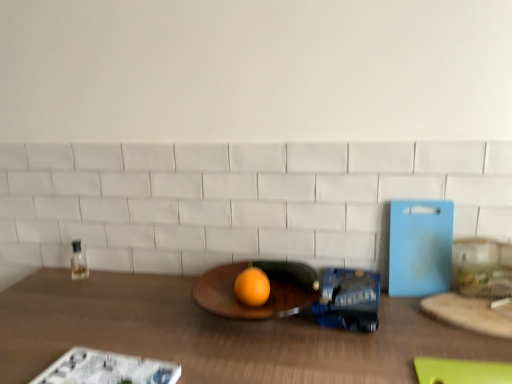
Question: Considering the relative sizes of orange matte grapefruit at center and wooden table at center in the image provided, is orange matte grapefruit at center shorter than wooden table at center?

Choices:
 (A) no
 (B) yes

Answer: (B)

Question: Is orange matte grapefruit at center facing away from wooden table at center?

Choices:
 (A) yes
 (B) no

Answer: (B)

Question: Is wooden table at center located within orange matte grapefruit at center?

Choices:
 (A) yes
 (B) no

Answer: (B)

Question: Considering the relative positions of orange matte grapefruit at center and wooden table at center in the image provided, is orange matte grapefruit at center behind wooden table at center?

Choices:
 (A) no
 (B) yes

Answer: (B)

Question: Is orange matte grapefruit at center far from wooden table at center?

Choices:
 (A) no
 (B) yes

Answer: (A)

Question: Is the depth of orange matte grapefruit at center less than that of wooden table at center?

Choices:
 (A) yes
 (B) no

Answer: (B)

Question: From the image's perspective, is clear glass bottle at left located beneath wooden cutting board at right?

Choices:
 (A) no
 (B) yes

Answer: (A)

Question: Does clear glass bottle at left lie in front of wooden cutting board at right?

Choices:
 (A) yes
 (B) no

Answer: (B)

Question: Is clear glass bottle at left facing towards wooden cutting board at right?

Choices:
 (A) yes
 (B) no

Answer: (B)

Question: Is clear glass bottle at left to the right of wooden cutting board at right from the viewer's perspective?

Choices:
 (A) yes
 (B) no

Answer: (B)

Question: Would you say wooden cutting board at right is part of clear glass bottle at left's contents?

Choices:
 (A) yes
 (B) no

Answer: (B)

Question: Considering the relative positions of clear glass bottle at left and wooden cutting board at right in the image provided, is clear glass bottle at left to the left of wooden cutting board at right from the viewer's perspective?

Choices:
 (A) yes
 (B) no

Answer: (A)

Question: Is wooden table at center smaller than wooden cutting board at right?

Choices:
 (A) no
 (B) yes

Answer: (A)